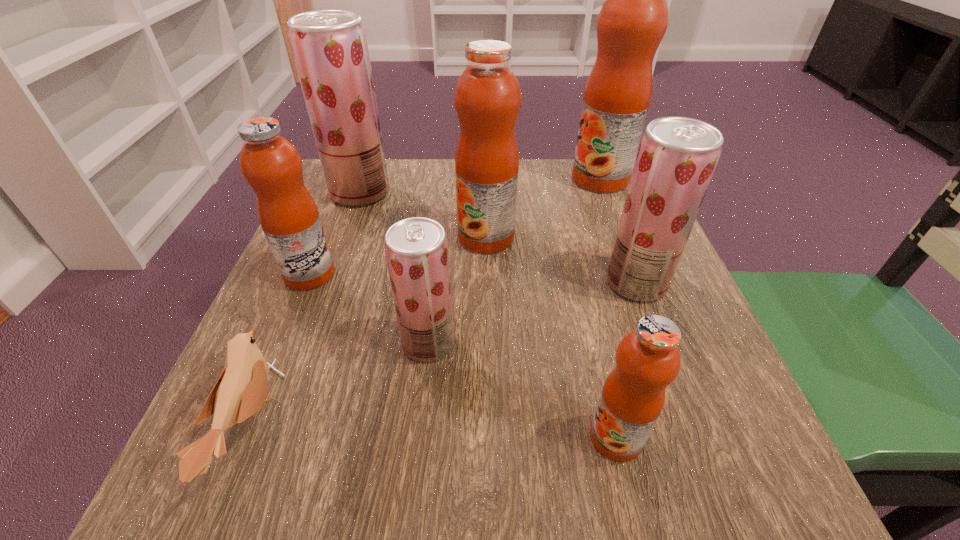
This screenshot has height=540, width=960. Find the location of `vacant region between the second biggest strawberry fruit juice and the smallest strawberry fruit juice`. vacant region between the second biggest strawberry fruit juice and the smallest strawberry fruit juice is located at coordinates (532, 313).

Locate an element on the screen. free point between the second farthest orange fruit juice and the bird is located at coordinates (368, 332).

This screenshot has width=960, height=540. Find the location of `vacant space that is in between the fifth nearest fruit juice and the rightmost strawberry fruit juice`. vacant space that is in between the fifth nearest fruit juice and the rightmost strawberry fruit juice is located at coordinates (562, 260).

You are a GUI agent. You are given a task and a screenshot of the screen. Output one action in this format:
    pyautogui.click(x=<x>, y=<y>)
    Task: Click on the unoccupied position between the farthest strawberry fruit juice and the shortest object
    This screenshot has height=540, width=960.
    Given the screenshot: What is the action you would take?
    pyautogui.click(x=305, y=309)

Find the location of `blank region between the nearest strawberry fruit juice and the sixth object from left to right`. blank region between the nearest strawberry fruit juice and the sixth object from left to right is located at coordinates (522, 390).

Locate an element on the screen. empty space that is in between the biggest strawberry fruit juice and the nearest fruit juice is located at coordinates (488, 315).

Image resolution: width=960 pixels, height=540 pixels. What are the coordinates of `blank region between the leftmost orange fruit juice and the shortest object` in the screenshot? It's located at (279, 350).

Locate an element on the screen. This screenshot has width=960, height=540. free space between the leftmost orange fruit juice and the biggest strawberry fruit juice is located at coordinates (335, 233).

Locate which object is the fourth closest to the third object from right to left. Please provide its 2D coordinates. Your answer should be formatted as a tuple, i.e. [(x, y)], where the tuple contains the x and y coordinates of a point satisfying the conditions above.

[(239, 393)]

Locate an element on the screen. object that is the seventh closest to the second orange fruit juice from right to left is located at coordinates (330, 49).